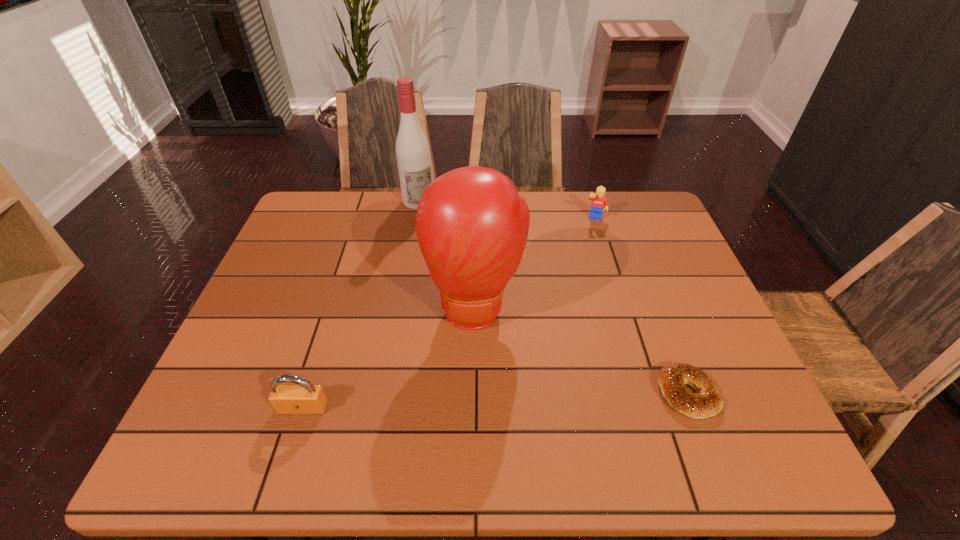
This screenshot has height=540, width=960. What are the coordinates of `object that is the closest one to the Lego` in the screenshot? It's located at (472, 227).

Where is `object identified as the second closest to the Lego`? object identified as the second closest to the Lego is located at coordinates (412, 149).

Find the location of `vacant space that satisfies the following two spatial constraints: 1. on the front side of the shortest object; 2. on the left side of the farthest object`. vacant space that satisfies the following two spatial constraints: 1. on the front side of the shortest object; 2. on the left side of the farthest object is located at coordinates (385, 393).